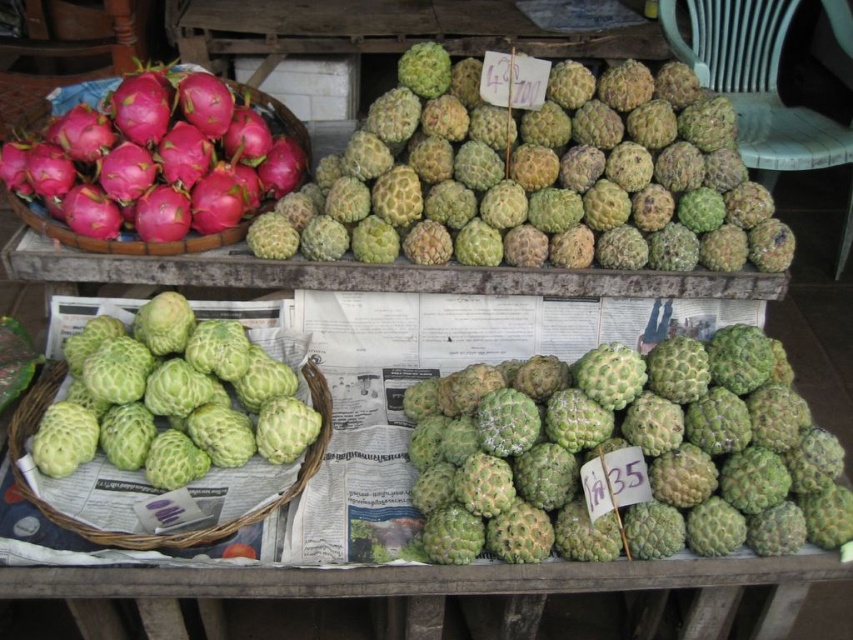
Question: Which point is farther from the camera taking this photo?

Choices:
 (A) (672, 179)
 (B) (537, 525)

Answer: (A)

Question: Can you confirm if green rough custard apple at center is positioned above pink matte dragon fruit basket at left?

Choices:
 (A) no
 (B) yes

Answer: (A)

Question: Can you confirm if green rough durian at upper center is positioned above pink matte dragon fruit basket at left?

Choices:
 (A) no
 (B) yes

Answer: (A)

Question: Is green rough custard apple at center closer to camera compared to green matte cherimoya at center?

Choices:
 (A) yes
 (B) no

Answer: (A)

Question: Which of the following is the closest to the observer?

Choices:
 (A) (752, 369)
 (B) (65, 416)

Answer: (A)

Question: Considering the real-world distances, which object is closest to the green rough durian at upper center?

Choices:
 (A) pink matte dragon fruit basket at left
 (B) green matte cherimoya at center

Answer: (B)